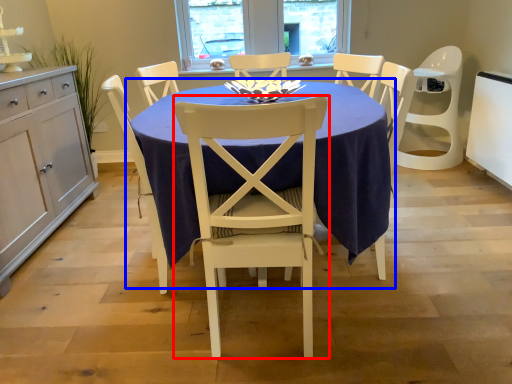
Question: Which object appears closest to the camera in this image, chair (highlighted by a red box) or kitchen & dining room table (highlighted by a blue box)?

Choices:
 (A) chair
 (B) kitchen & dining room table

Answer: (A)